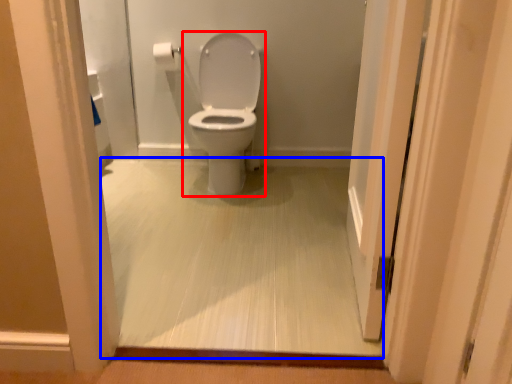
Question: Which point is closer to the camera, toilet (highlighted by a red box) or corridor (highlighted by a blue box)?

Choices:
 (A) toilet
 (B) corridor

Answer: (B)